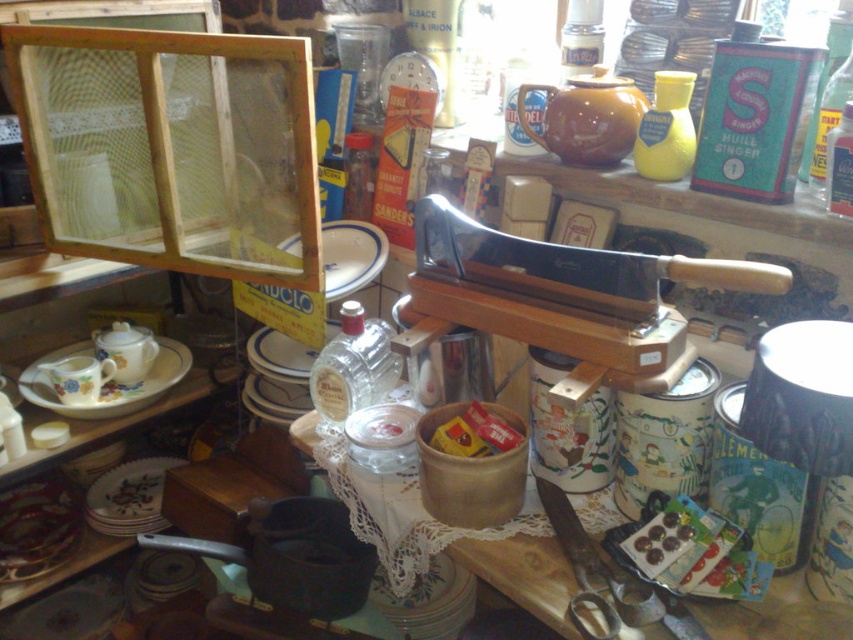
Question: Which object is farther from the camera taking this photo?

Choices:
 (A) white porcelain plate at center
 (B) floral ceramic plate at center

Answer: (B)

Question: Which point is closer to the camera?

Choices:
 (A) brown matte teapot at upper center
 (B) white porcelain plate at center
 (C) porcelain plate at lower left

Answer: (A)

Question: Which point is farther from the camera taking this photo?

Choices:
 (A) (328, 276)
 (B) (91, 513)
 (C) (39, 404)
 (D) (610, 109)

Answer: (B)

Question: Is brown matte teapot at upper center closer to the viewer compared to floral ceramic plate at center?

Choices:
 (A) no
 (B) yes

Answer: (B)

Question: Can you confirm if wooden cutting board at center is smaller than porcelain plate at lower left?

Choices:
 (A) no
 (B) yes

Answer: (A)

Question: Where is brown matte teapot at upper center located in relation to white porcelain plate at center in the image?

Choices:
 (A) below
 (B) above

Answer: (B)